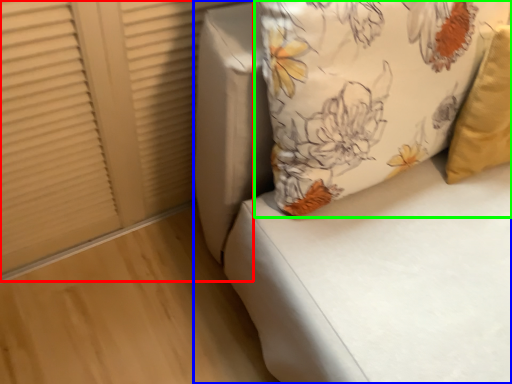
Question: Considering the real-world distances, which object is farthest from shutter (highlighted by a red box)? furniture (highlighted by a blue box) or pillow (highlighted by a green box)?

Choices:
 (A) furniture
 (B) pillow

Answer: (B)